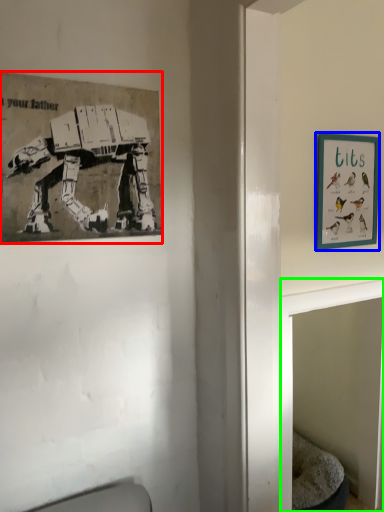
Question: Which object is positioned farthest from picture frame (highlighted by a red box)? Select from picture frame (highlighted by a blue box) and table (highlighted by a green box).

Choices:
 (A) picture frame
 (B) table

Answer: (A)